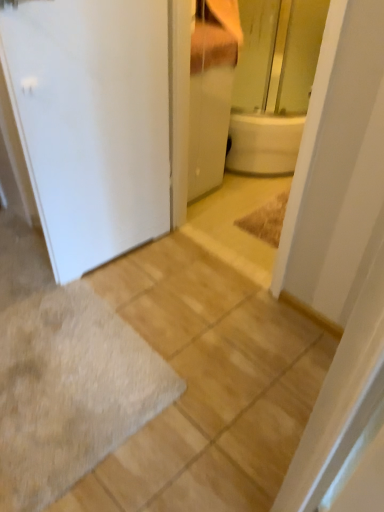
Question: Is gray shaggy bath mat at lower left directly adjacent to white matte door at left?

Choices:
 (A) no
 (B) yes

Answer: (A)

Question: From the image's perspective, is gray shaggy bath mat at lower left below white matte door at left?

Choices:
 (A) no
 (B) yes

Answer: (B)

Question: Can you confirm if gray shaggy bath mat at lower left is positioned to the left of white matte door at left?

Choices:
 (A) yes
 (B) no

Answer: (A)

Question: Does gray shaggy bath mat at lower left have a smaller size compared to white matte door at left?

Choices:
 (A) no
 (B) yes

Answer: (B)

Question: Does gray shaggy bath mat at lower left turn towards white matte door at left?

Choices:
 (A) no
 (B) yes

Answer: (A)

Question: From the image's perspective, is gray shaggy bath mat at lower left positioned above or below white glossy cabinet at upper center?

Choices:
 (A) below
 (B) above

Answer: (A)

Question: In terms of width, does gray shaggy bath mat at lower left look wider or thinner when compared to white glossy cabinet at upper center?

Choices:
 (A) thin
 (B) wide

Answer: (B)

Question: Considering the relative positions of gray shaggy bath mat at lower left and white glossy cabinet at upper center in the image provided, is gray shaggy bath mat at lower left to the left or to the right of white glossy cabinet at upper center?

Choices:
 (A) right
 (B) left

Answer: (B)

Question: Looking at the image, does gray shaggy bath mat at lower left seem bigger or smaller compared to white glossy cabinet at upper center?

Choices:
 (A) big
 (B) small

Answer: (B)

Question: From a real-world perspective, is white glossy cabinet at upper center positioned above or below gray shaggy bath mat at lower left?

Choices:
 (A) above
 (B) below

Answer: (A)

Question: In terms of height, does white glossy cabinet at upper center look taller or shorter compared to gray shaggy bath mat at lower left?

Choices:
 (A) short
 (B) tall

Answer: (B)

Question: Is point (198, 129) closer or farther from the camera than point (81, 353)?

Choices:
 (A) farther
 (B) closer

Answer: (A)

Question: From the image's perspective, is white glossy cabinet at upper center positioned above or below gray shaggy bath mat at lower left?

Choices:
 (A) below
 (B) above

Answer: (B)

Question: From the image's perspective, relative to white matte door at left, is gray shaggy bath mat at lower left above or below?

Choices:
 (A) below
 (B) above

Answer: (A)

Question: Choose the correct answer: Is gray shaggy bath mat at lower left inside white matte door at left or outside it?

Choices:
 (A) inside
 (B) outside

Answer: (B)